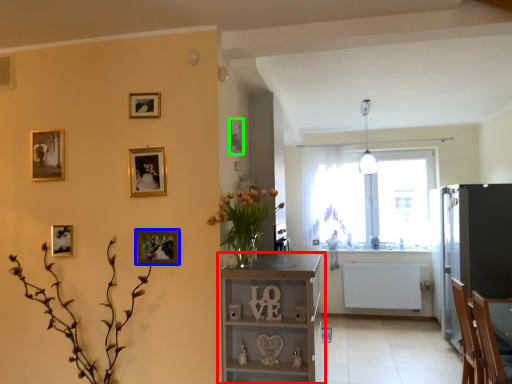
Question: Based on their relative distances, which object is farther from shelf (highlighted by a red box)? Choose from picture frame (highlighted by a blue box) and picture frame (highlighted by a green box).

Choices:
 (A) picture frame
 (B) picture frame

Answer: (B)